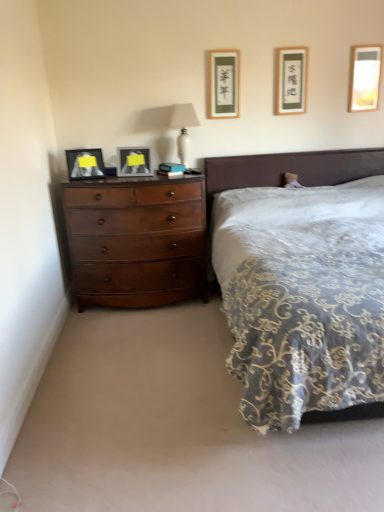
Question: Can you confirm if matte black picture frame at left, which ranks as the fifth picture frame in right-to-left order, is positioned to the left of matte gold picture frame at upper center, which is the third picture frame from right to left?

Choices:
 (A) yes
 (B) no

Answer: (A)

Question: Does matte black picture frame at left, which is the first picture frame from left to right, have a lesser width compared to matte gold picture frame at upper center, the 3th picture frame viewed from the left?

Choices:
 (A) yes
 (B) no

Answer: (B)

Question: From the image's perspective, is matte black picture frame at left, which ranks as the fifth picture frame in right-to-left order, located above matte gold picture frame at upper center, which is the third picture frame from right to left?

Choices:
 (A) yes
 (B) no

Answer: (B)

Question: Is matte black picture frame at left, which ranks as the fifth picture frame in right-to-left order, aimed at matte gold picture frame at upper center, which is the third picture frame from right to left?

Choices:
 (A) yes
 (B) no

Answer: (B)

Question: Can you confirm if matte black picture frame at left, which is the first picture frame from left to right, is shorter than matte gold picture frame at upper center, the 3th picture frame viewed from the left?

Choices:
 (A) no
 (B) yes

Answer: (B)

Question: Can you confirm if matte black picture frame at left, which is the first picture frame from left to right, is smaller than matte gold picture frame at upper center, which is the third picture frame from right to left?

Choices:
 (A) yes
 (B) no

Answer: (B)

Question: Is matte gold picture frame at upper center, which is the third picture frame from right to left, surrounding matte glass picture frame at left, positioned as the fourth picture frame in right-to-left order?

Choices:
 (A) no
 (B) yes

Answer: (A)

Question: From the image's perspective, is matte gold picture frame at upper center, the 3th picture frame viewed from the left, located beneath matte glass picture frame at left, the second picture frame in the left-to-right sequence?

Choices:
 (A) no
 (B) yes

Answer: (A)

Question: Can you confirm if matte gold picture frame at upper center, which is the third picture frame from right to left, is positioned to the right of matte glass picture frame at left, the second picture frame in the left-to-right sequence?

Choices:
 (A) no
 (B) yes

Answer: (B)

Question: Is the position of matte gold picture frame at upper center, which is the third picture frame from right to left, less distant than that of matte glass picture frame at left, positioned as the fourth picture frame in right-to-left order?

Choices:
 (A) no
 (B) yes

Answer: (A)

Question: Is matte gold picture frame at upper center, the 3th picture frame viewed from the left, completely or partially outside of matte glass picture frame at left, the second picture frame in the left-to-right sequence?

Choices:
 (A) no
 (B) yes

Answer: (B)

Question: Considering the relative sizes of matte gold picture frame at upper center, which is the third picture frame from right to left, and matte glass picture frame at left, the second picture frame in the left-to-right sequence, in the image provided, is matte gold picture frame at upper center, which is the third picture frame from right to left, bigger than matte glass picture frame at left, the second picture frame in the left-to-right sequence,?

Choices:
 (A) no
 (B) yes

Answer: (A)

Question: From the image's perspective, is matte gold picture frame at upper center, the 3th picture frame viewed from the left, over matte glass picture frame at upper right, positioned as the first picture frame in right-to-left order?

Choices:
 (A) no
 (B) yes

Answer: (A)